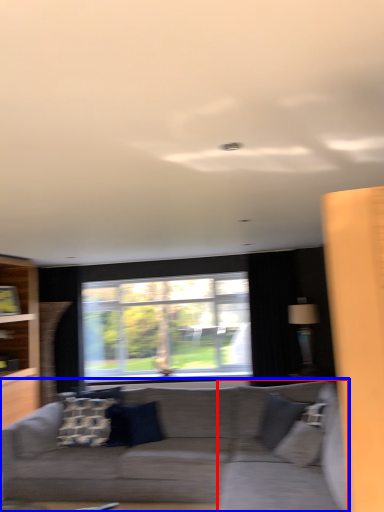
Question: Among these objects, which one is farthest to the camera, swivel chair (highlighted by a red box) or studio couch (highlighted by a blue box)?

Choices:
 (A) swivel chair
 (B) studio couch

Answer: (A)